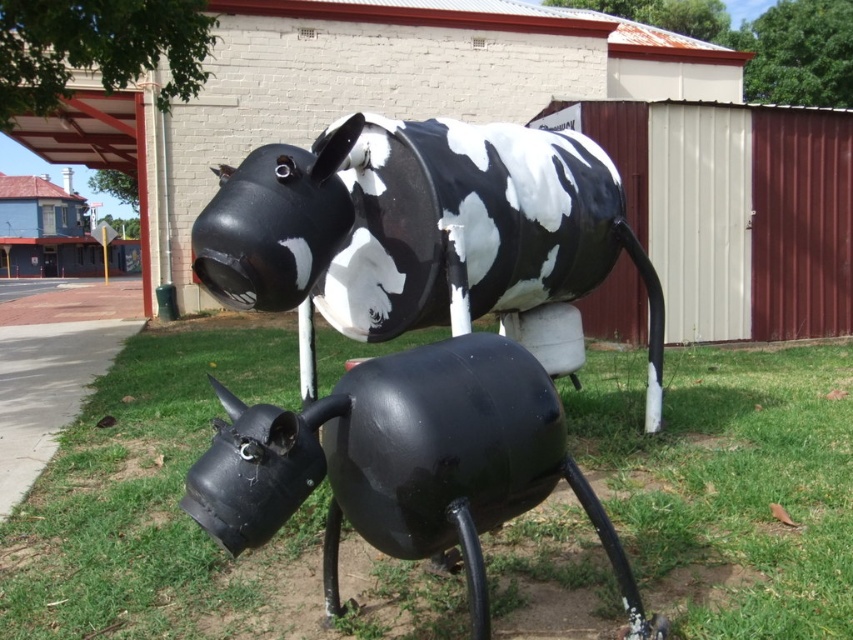
Question: Which of these objects is positioned closest to the glossy black cow at lower center?

Choices:
 (A) black matte cow at center
 (B) green grass at lower center

Answer: (A)

Question: Can you confirm if black matte cow at center is bigger than glossy black cow at lower center?

Choices:
 (A) no
 (B) yes

Answer: (B)

Question: Considering the real-world distances, which object is closest to the black matte cow at center?

Choices:
 (A) green grass at lower center
 (B) glossy black cow at lower center

Answer: (B)

Question: Is green grass at lower center smaller than black matte cow at center?

Choices:
 (A) no
 (B) yes

Answer: (B)

Question: Does green grass at lower center appear under black matte cow at center?

Choices:
 (A) no
 (B) yes

Answer: (B)

Question: Which object is the closest to the glossy black cow at lower center?

Choices:
 (A) green grass at lower center
 (B) black matte cow at center

Answer: (B)